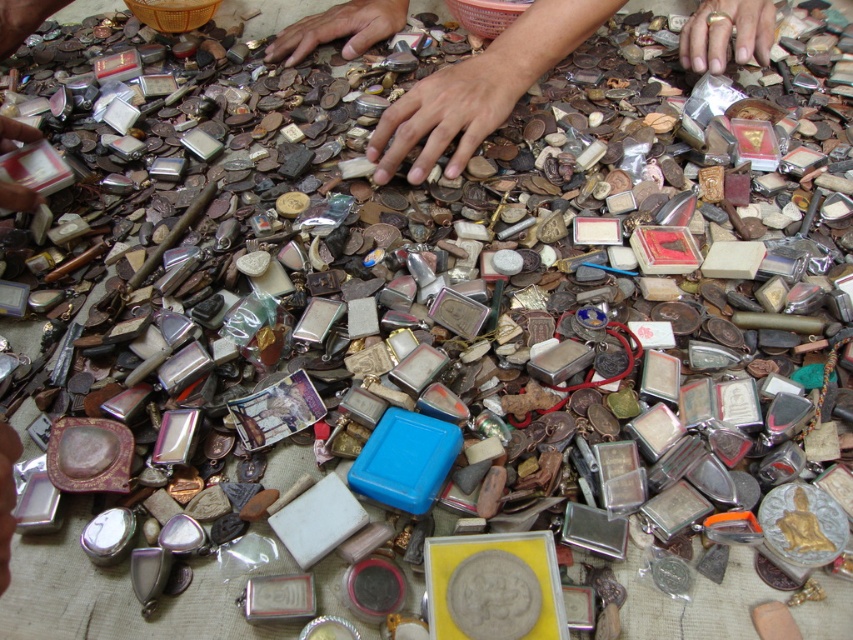
Does gold metallic ring at upper center appear over brown matte hand at upper center?

Incorrect, gold metallic ring at upper center is not positioned above brown matte hand at upper center.

Who is higher up, gold metallic ring at upper center or brown matte hand at upper center?

brown matte hand at upper center is above.

The image size is (853, 640). In order to click on gold metallic ring at upper center in this screenshot , I will do `click(726, 33)`.

The width and height of the screenshot is (853, 640). Find the location of `gold metallic ring at upper center`. gold metallic ring at upper center is located at coordinates (726, 33).

Who is positioned more to the left, smooth brown hands at center or gold metallic ring at upper center?

Positioned to the left is smooth brown hands at center.

Measure the distance between smooth brown hands at center and gold metallic ring at upper center.

A distance of 4.51 inches exists between smooth brown hands at center and gold metallic ring at upper center.

Where is `smooth brown hands at center`? smooth brown hands at center is located at coordinates (480, 88).

Locate an element on the screen. The width and height of the screenshot is (853, 640). smooth brown hands at center is located at coordinates (480, 88).

Between matte silver coin at center and gold metallic ring at upper center, which one is positioned lower?

matte silver coin at center

Can you confirm if matte silver coin at center is positioned to the left of gold metallic ring at upper center?

Yes, matte silver coin at center is to the left of gold metallic ring at upper center.

The height and width of the screenshot is (640, 853). Describe the element at coordinates (451, 112) in the screenshot. I see `matte silver coin at center` at that location.

Find the location of a particular element. The width and height of the screenshot is (853, 640). matte silver coin at center is located at coordinates (451, 112).